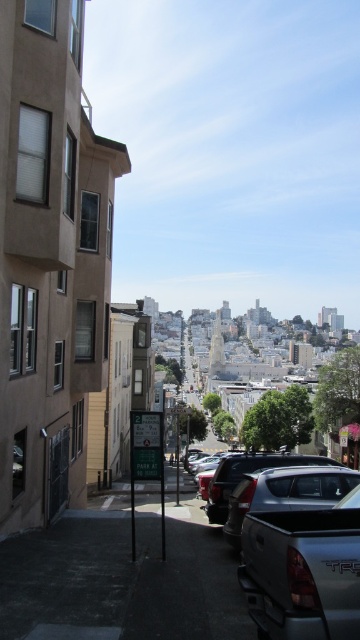
You are a delivery driver trying to park your truck, which is 2.5 meters wide, in the parking spot near the silver metallic truck at lower right. The parking spot has a width restriction indicated by the metallic silver parking sign at center. Can your truck fit in the spot based on the sign?

The silver metallic truck at lower right might be wider than the metallic silver parking sign at center, but since the sign indicates parking regulations for specific hours, there is no information provided about width restrictions. Therefore, it is unclear if the truck will fit. Check the sign for width limits or look for additional signage.